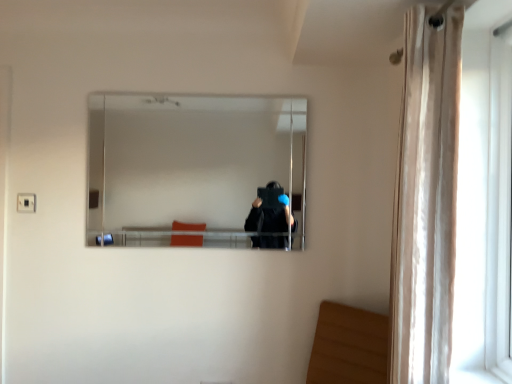
Question: Looking at the image, does clear glass mirror at center seem bigger or smaller compared to beige sheer curtain at right?

Choices:
 (A) small
 (B) big

Answer: (A)

Question: Considering the positions of clear glass mirror at center and beige sheer curtain at right in the image, is clear glass mirror at center taller or shorter than beige sheer curtain at right?

Choices:
 (A) tall
 (B) short

Answer: (B)

Question: Considering the real-world distances, which object is closest to the clear glass mirror at center?

Choices:
 (A) beige sheer curtain at right
 (B) white plastic screen door at right

Answer: (A)

Question: Which of these objects is positioned farthest from the clear glass mirror at center?

Choices:
 (A) white plastic screen door at right
 (B) beige sheer curtain at right

Answer: (A)